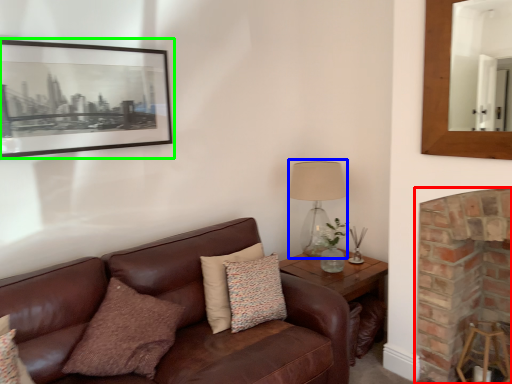
Question: Estimate the real-world distances between objects in this image. Which object is closer to fireplace (highlighted by a red box), table lamp (highlighted by a blue box) or picture frame (highlighted by a green box)?

Choices:
 (A) table lamp
 (B) picture frame

Answer: (A)